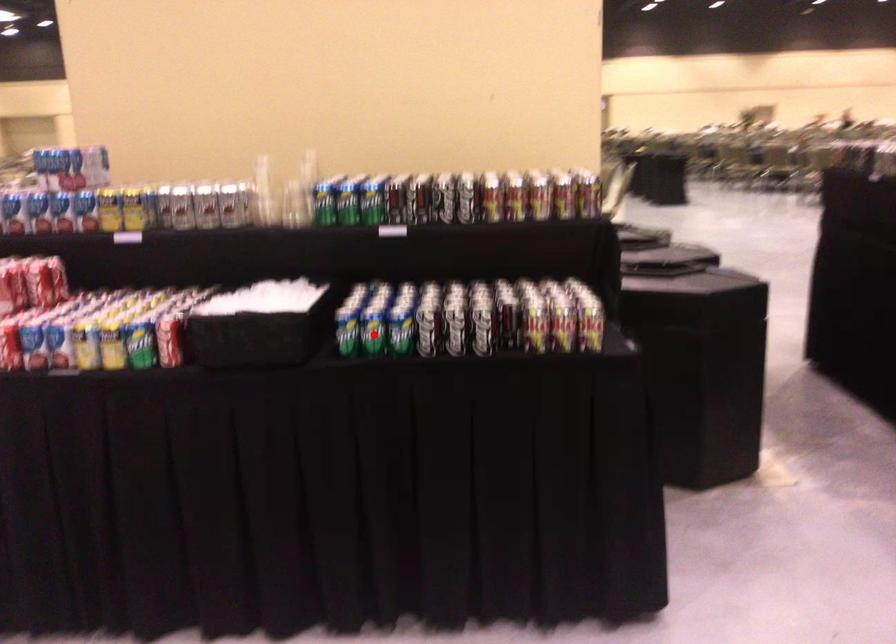
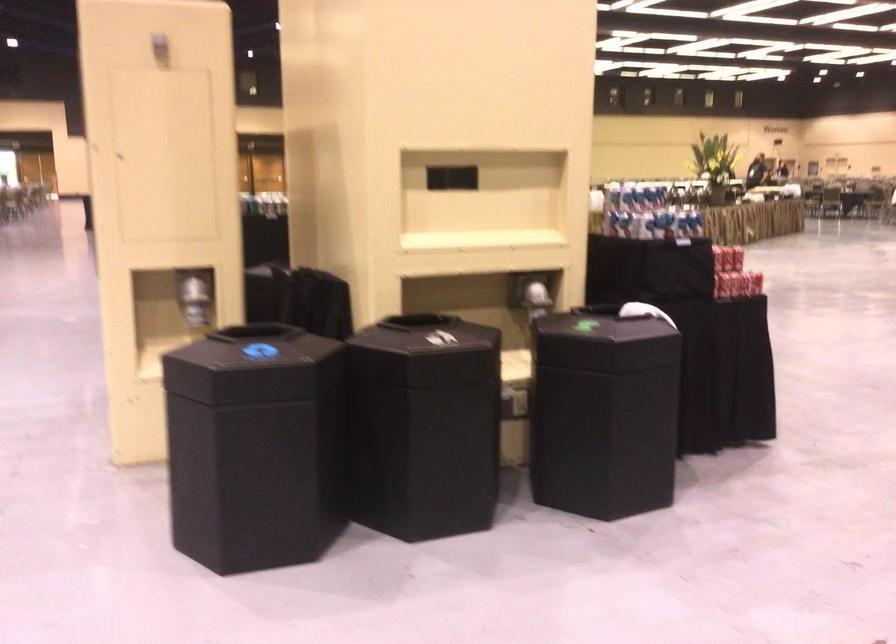
Question: I am providing you with two images of the same scene from different viewpoints. A red point is marked on the first image. At the location where the point appears in image 1, is it still visible in image 2?

Choices:
 (A) Yes
 (B) No

Answer: (B)